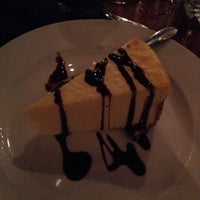
The image size is (200, 200). I want to click on white plate, so (195, 128).